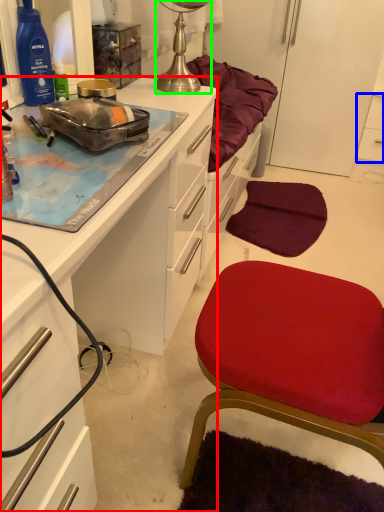
Question: Considering the real-world distances, which object is closest to cabinetry (highlighted by a red box)? cabinetry (highlighted by a blue box) or lamp (highlighted by a green box).

Choices:
 (A) cabinetry
 (B) lamp

Answer: (B)